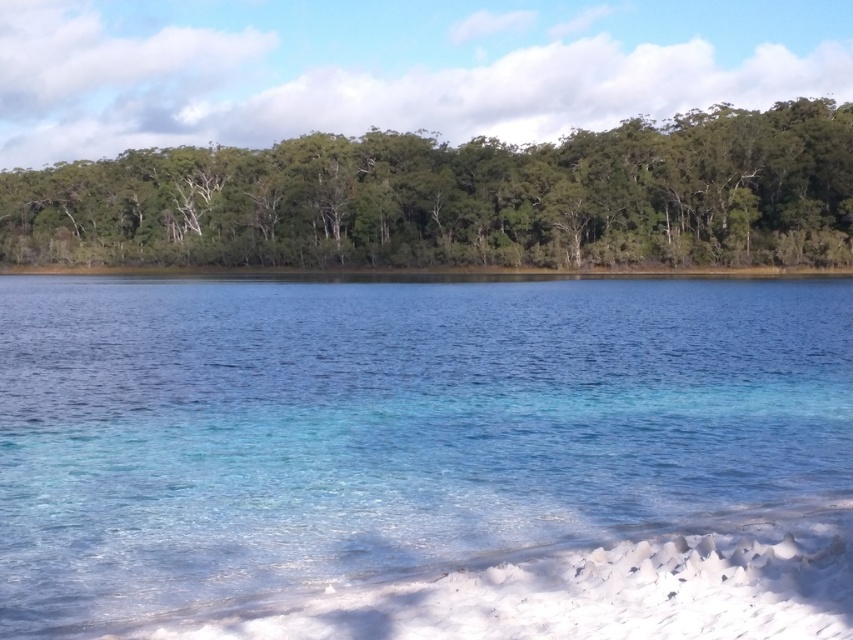
You are standing on the shore and want to compare the sizes of the clear glass water at center and the green leafy trees at upper center. Which one appears larger in the image?

The green leafy trees at upper center appear larger than the clear glass water at center.